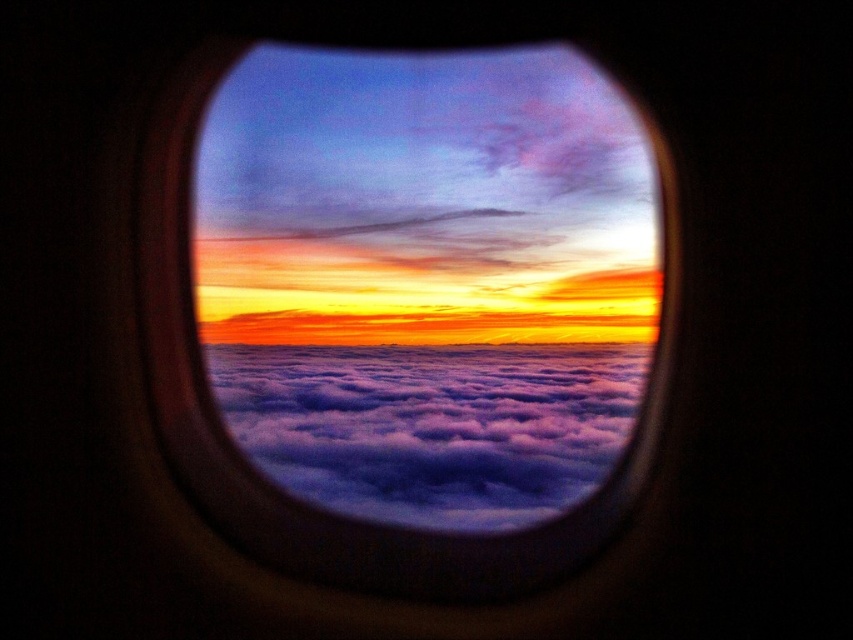
Question: Where is transparent glass airplane window at center located in relation to cloudy at center in the image?

Choices:
 (A) above
 (B) below

Answer: (A)

Question: Among these points, which one is nearest to the camera?

Choices:
 (A) pos(321,253)
 (B) pos(546,509)

Answer: (B)

Question: Which object appears farthest from the camera in this image?

Choices:
 (A) transparent glass airplane window at center
 (B) cloudy at center

Answer: (B)

Question: From the image, what is the correct spatial relationship of transparent glass airplane window at center in relation to cloudy at center?

Choices:
 (A) below
 (B) above

Answer: (B)

Question: Which of the following is the farthest from the observer?

Choices:
 (A) (380, 424)
 (B) (457, 275)

Answer: (B)

Question: Does transparent glass airplane window at center appear on the left side of cloudy at center?

Choices:
 (A) no
 (B) yes

Answer: (A)